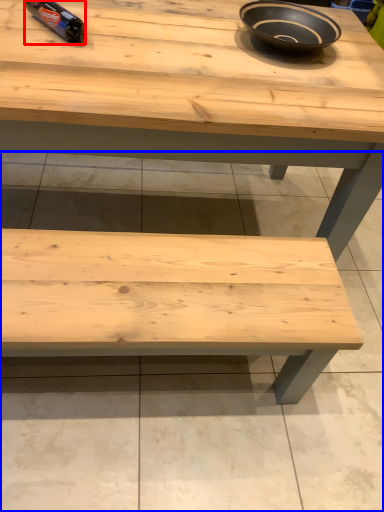
Question: Which object appears farthest to the camera in this image, bottle (highlighted by a red box) or concrete (highlighted by a blue box)?

Choices:
 (A) bottle
 (B) concrete

Answer: (A)